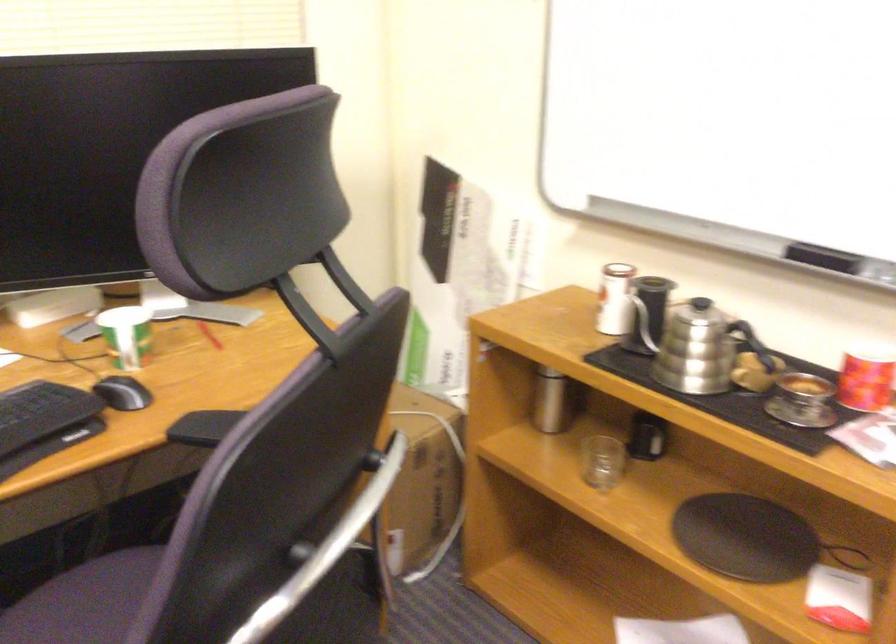
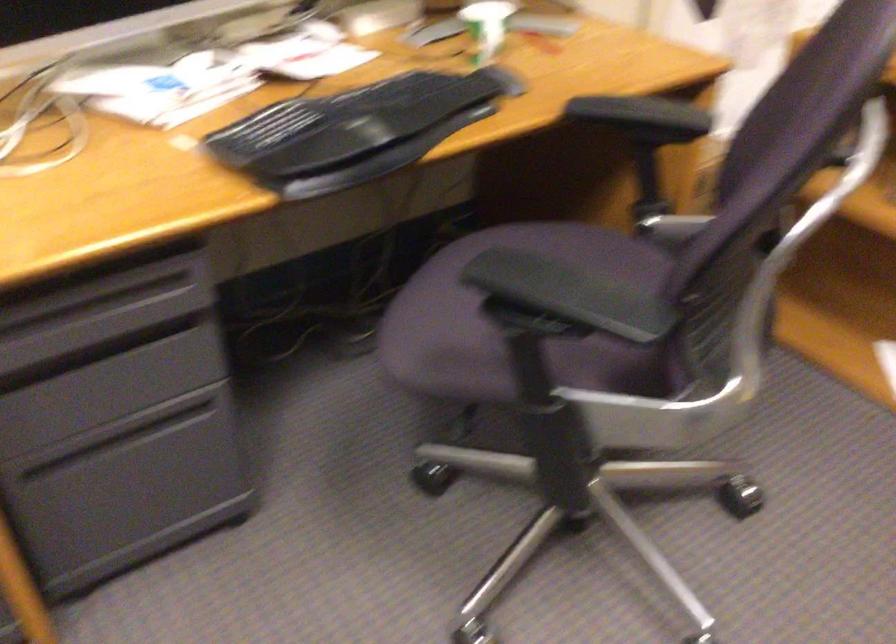
Question: Based on the continuous images, in which direction is the camera rotating? Reply with the corresponding letter.

Choices:
 (A) Left
 (B) Right
 (C) Up
 (D) Down

Answer: (D)